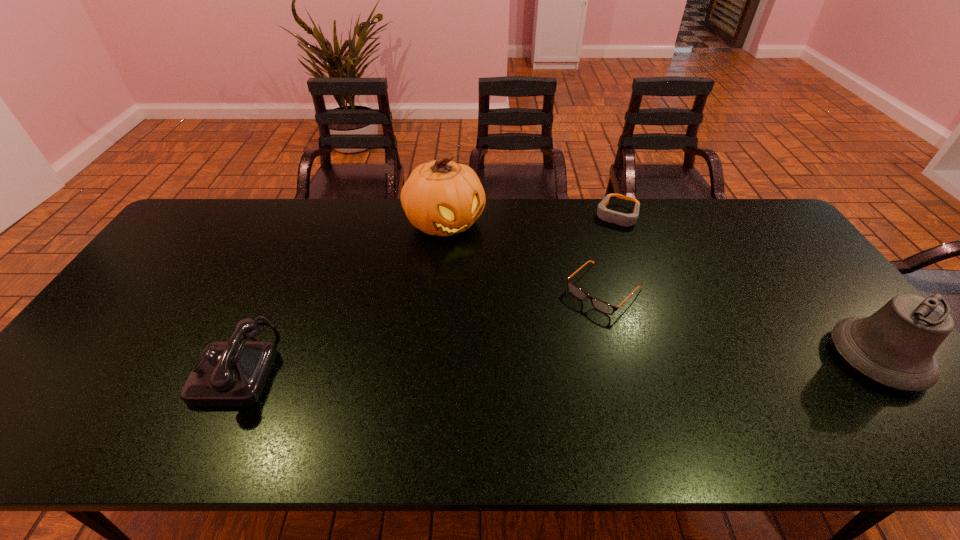
Find the location of a particular element. This screenshot has width=960, height=540. free location located 0.370m on the front and back of the goggles is located at coordinates (579, 300).

At what (x,y) coordinates should I click in order to perform the action: click on pumpkin that is at the far edge. Please return your answer as a coordinate pair (x, y). Looking at the image, I should click on (443, 198).

You are a GUI agent. You are given a task and a screenshot of the screen. Output one action in this format:
    pyautogui.click(x=<x>, y=<y>)
    Task: Click on the goggles that is at the far edge
    
    Given the screenshot: What is the action you would take?
    pyautogui.click(x=622, y=219)

Find the location of a particular element. This screenshot has width=960, height=540. telephone located at the near edge is located at coordinates (227, 373).

Identify the location of bell present at the near edge. The image size is (960, 540). pos(895,346).

The width and height of the screenshot is (960, 540). I want to click on object at the right edge, so click(895, 346).

The image size is (960, 540). I want to click on object that is at the near right corner, so click(x=895, y=346).

Where is `free point at the far edge`? Image resolution: width=960 pixels, height=540 pixels. free point at the far edge is located at coordinates (687, 204).

In the image, there is a desktop. Find the location of `vacant space at the near edge`. vacant space at the near edge is located at coordinates (513, 392).

Where is `vacant space at the right edge of the desktop`? The image size is (960, 540). vacant space at the right edge of the desktop is located at coordinates (782, 267).